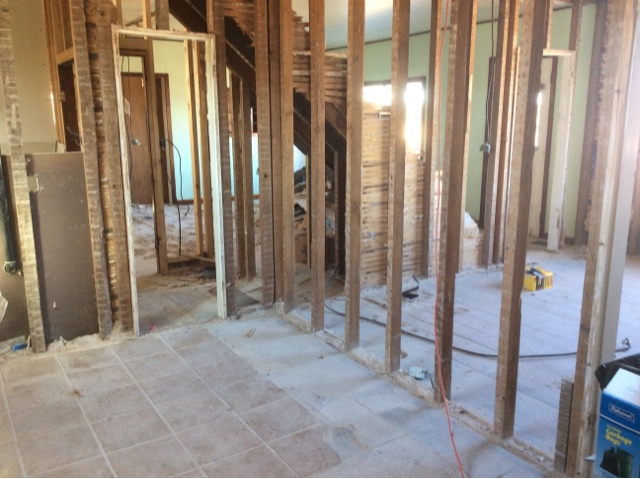
This screenshot has width=640, height=479. In order to click on unfinished floor before tiles in this screenshot , I will do `click(272, 344)`, `click(360, 408)`, `click(418, 458)`.